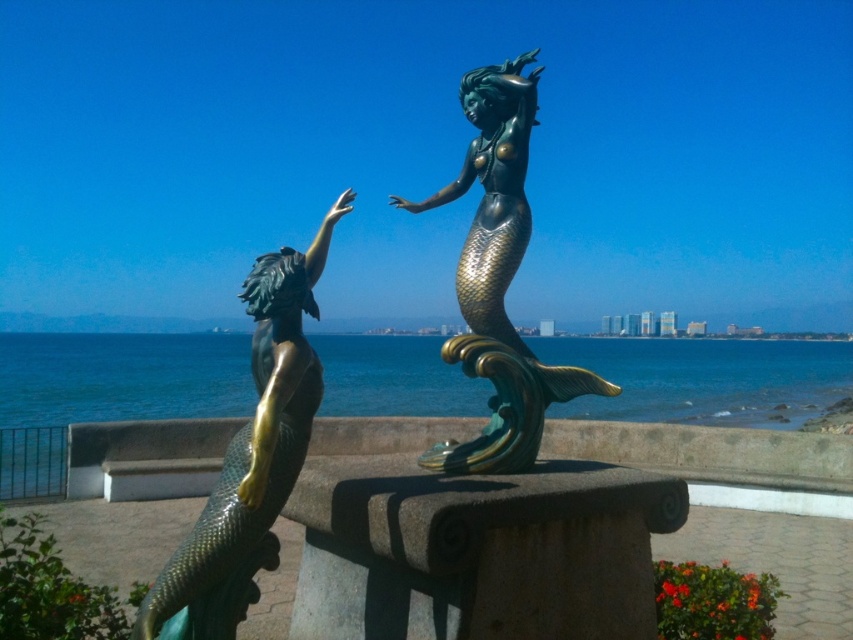
Question: Is green patina mermaid at center above bronze mermaid at center?

Choices:
 (A) yes
 (B) no

Answer: (B)

Question: Is blue-green water at center further to the viewer compared to bronze mermaid at center?

Choices:
 (A) no
 (B) yes

Answer: (A)

Question: Which object is closer to the camera taking this photo?

Choices:
 (A) blue-green water at center
 (B) green patina mermaid at center
 (C) bronze mermaid at center

Answer: (B)

Question: Which object is the farthest from the blue-green water at center?

Choices:
 (A) green patina mermaid at center
 (B) bronze mermaid at center

Answer: (A)

Question: Which object is closer to the camera taking this photo?

Choices:
 (A) green patina mermaid at center
 (B) bronze mermaid at center
 (C) blue-green water at center

Answer: (A)

Question: Is blue-green water at center above bronze mermaid at center?

Choices:
 (A) no
 (B) yes

Answer: (A)